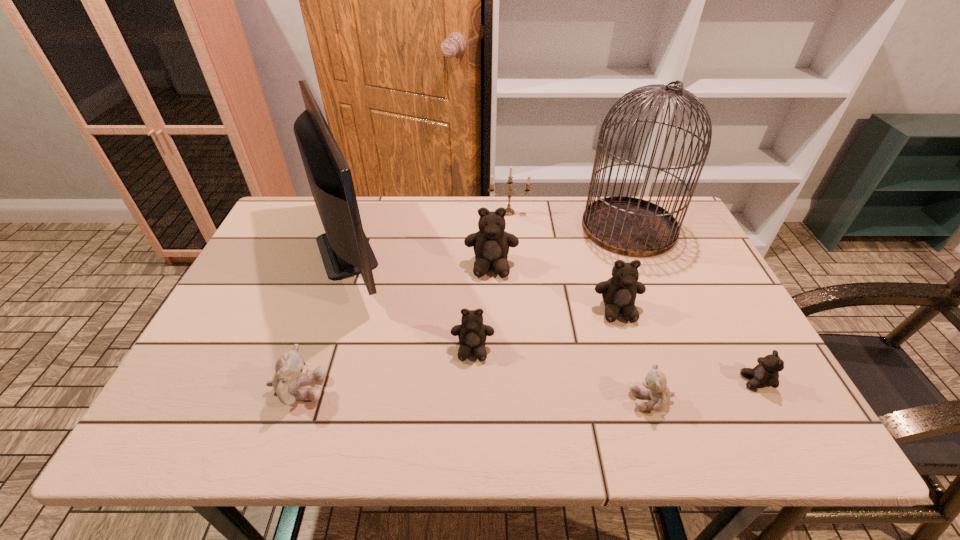
Where is `object that is at the left edge`? object that is at the left edge is located at coordinates (345, 250).

Where is `birdcage situated at the right edge`? Image resolution: width=960 pixels, height=540 pixels. birdcage situated at the right edge is located at coordinates (629, 226).

Locate an element on the screen. This screenshot has width=960, height=540. teddy bear present at the right edge is located at coordinates (765, 374).

Where is `object situated at the far left corner`? object situated at the far left corner is located at coordinates (345, 250).

You are a GUI agent. You are given a task and a screenshot of the screen. Output one action in this format:
    pyautogui.click(x=<x>, y=<y>)
    Task: Click on the object present at the far right corner
    
    Given the screenshot: What is the action you would take?
    pyautogui.click(x=629, y=226)

What are the coordinates of `vacant region at the far edge of the desktop` in the screenshot? It's located at (540, 200).

Image resolution: width=960 pixels, height=540 pixels. I want to click on vacant space at the near edge of the desktop, so click(687, 431).

Locate an element on the screen. Image resolution: width=960 pixels, height=540 pixels. free region at the left edge of the desktop is located at coordinates (242, 318).

The height and width of the screenshot is (540, 960). What are the coordinates of `free space at the right edge` in the screenshot? It's located at (758, 389).

Locate an element on the screen. The width and height of the screenshot is (960, 540). vacant region at the far left corner of the desktop is located at coordinates (297, 219).